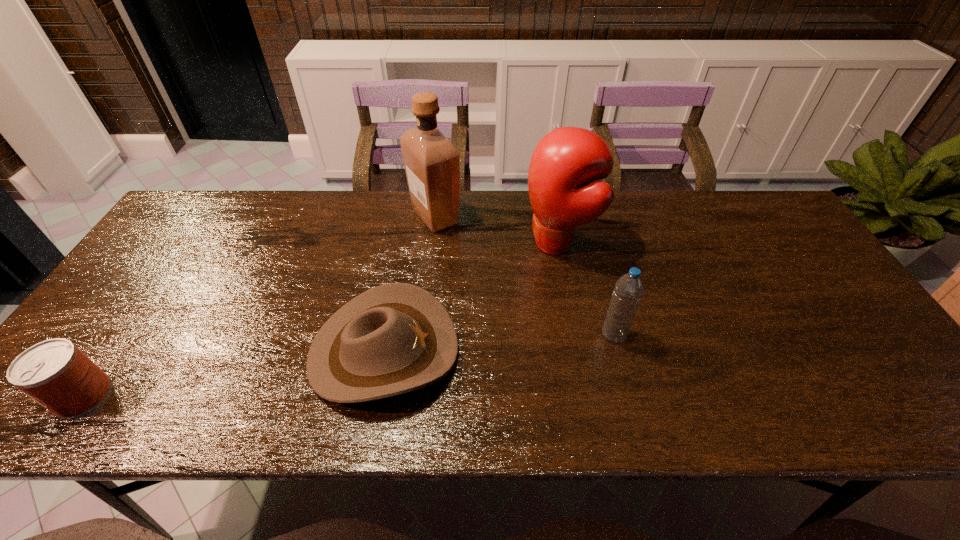
Locate an element on the screen. The height and width of the screenshot is (540, 960). free region at the left edge of the desktop is located at coordinates (105, 319).

Locate an element on the screen. Image resolution: width=960 pixels, height=540 pixels. vacant space at the right edge is located at coordinates (827, 285).

Locate an element on the screen. This screenshot has height=540, width=960. vacant space at the far left corner of the desktop is located at coordinates (x=228, y=209).

Locate an element on the screen. This screenshot has height=540, width=960. vacant position at the near left corner of the desktop is located at coordinates (81, 422).

Identify the location of empty space that is in between the liquor and the boxing glove. (496, 230).

Where is `free space between the liquor and the third tallest object`? free space between the liquor and the third tallest object is located at coordinates (524, 276).

This screenshot has width=960, height=540. Identify the location of empty space that is in between the can and the cowboy hat. tap(233, 373).

You are a GUI agent. You are given a task and a screenshot of the screen. Output one action in this format:
    pyautogui.click(x=<x>, y=<y>)
    Task: Click on the unoccupied position between the cowboy hat and the liquor
    This screenshot has width=960, height=540.
    Given the screenshot: What is the action you would take?
    pyautogui.click(x=410, y=284)

Locate an element on the screen. The height and width of the screenshot is (540, 960). free spot between the liquor and the leftmost object is located at coordinates (259, 306).

Identify the location of vacant space that's between the water bottle and the cowboy hat. This screenshot has height=540, width=960. (498, 343).